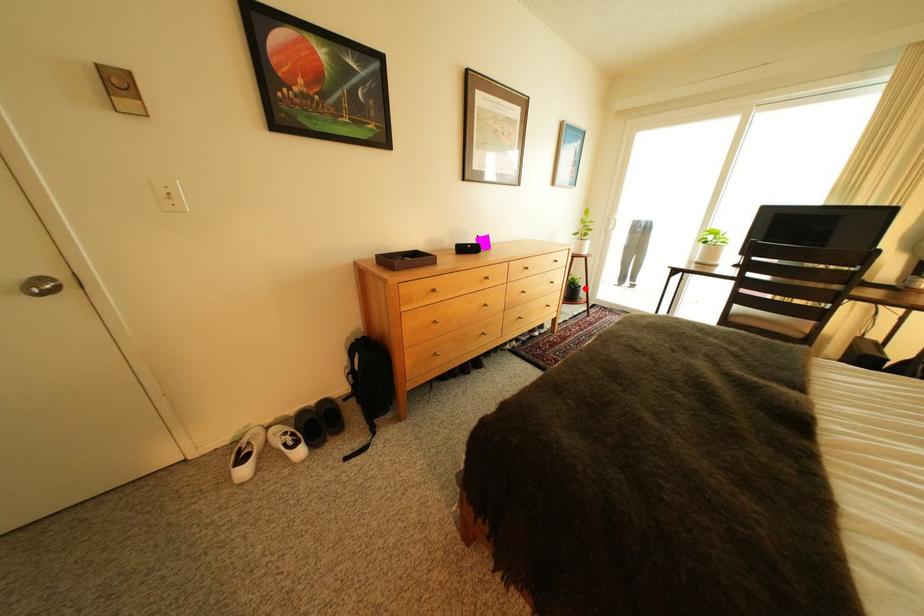
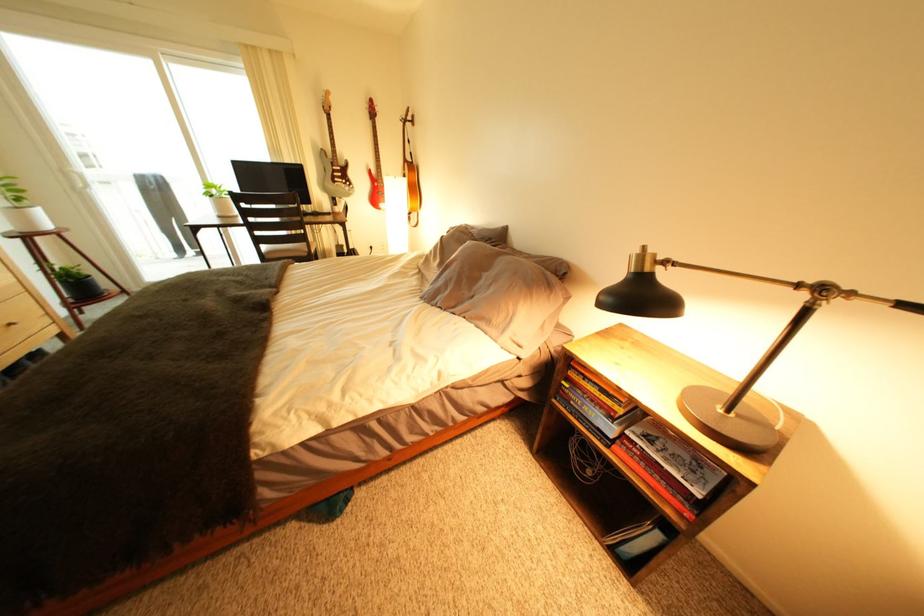
Find the pixel in the second image that matches the highlighted location in the first image.

(83, 282)